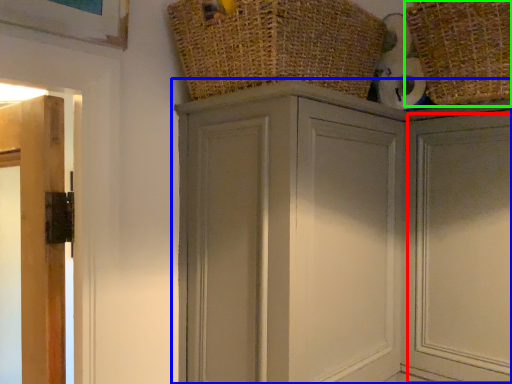
Question: Which is nearer to the door (highlighted by a red box)? cupboard (highlighted by a blue box) or basket (highlighted by a green box).

Choices:
 (A) cupboard
 (B) basket

Answer: (A)